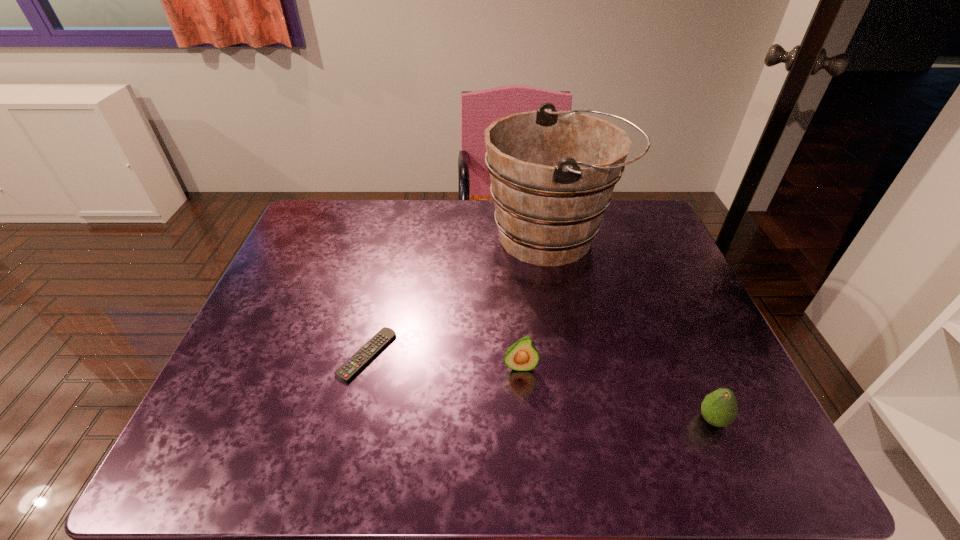
Find the location of a particular element. This screenshot has width=960, height=540. unoccupied area between the farther avocado and the nearer avocado is located at coordinates (616, 393).

This screenshot has height=540, width=960. Find the location of `empty space between the left avocado and the third tallest object`. empty space between the left avocado and the third tallest object is located at coordinates (616, 393).

What are the coordinates of `object that is the nearest to the farther avocado` in the screenshot? It's located at (379, 341).

Locate an element on the screen. object that stands as the third closest to the leftmost object is located at coordinates (719, 408).

Where is `vacant space that satisfies the following two spatial constraints: 1. on the handle side of the tallest object; 2. on the cut side of the farther avocado`? Image resolution: width=960 pixels, height=540 pixels. vacant space that satisfies the following two spatial constraints: 1. on the handle side of the tallest object; 2. on the cut side of the farther avocado is located at coordinates (579, 366).

Image resolution: width=960 pixels, height=540 pixels. In order to click on free location that satisfies the following two spatial constraints: 1. on the handle side of the farthest object; 2. on the cut side of the left avocado in this screenshot , I will do `click(579, 366)`.

Find the location of a particular element. This screenshot has width=960, height=540. blank space that satisfies the following two spatial constraints: 1. on the handle side of the farthest object; 2. on the right side of the shorter avocado is located at coordinates (589, 420).

Identify the location of blank space that satisfies the following two spatial constraints: 1. on the handle side of the third tallest object; 2. on the left side of the bucket. (589, 420).

Where is `vacant area that satisfies the following two spatial constraints: 1. on the handle side of the bucket; 2. on the cut side of the left avocado`? This screenshot has width=960, height=540. vacant area that satisfies the following two spatial constraints: 1. on the handle side of the bucket; 2. on the cut side of the left avocado is located at coordinates (579, 366).

The height and width of the screenshot is (540, 960). What are the coordinates of `free spot that satisfies the following two spatial constraints: 1. on the handle side of the farthest object; 2. on the right side of the shorter avocado` in the screenshot? It's located at (589, 420).